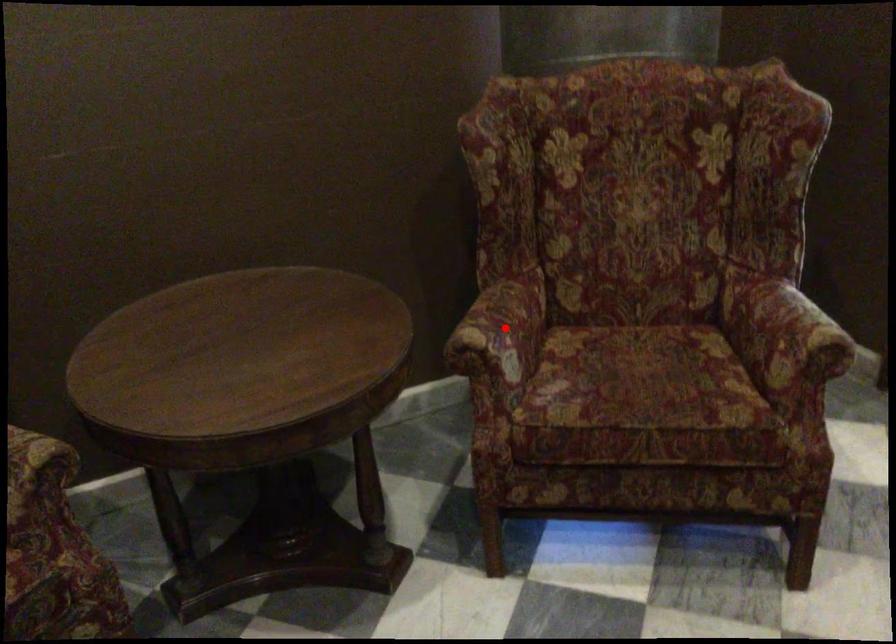
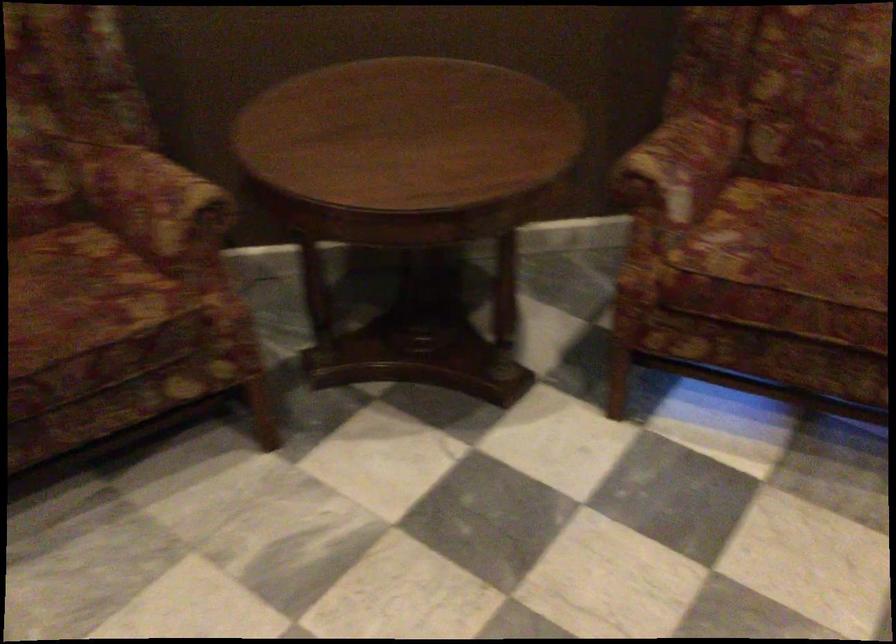
Locate, in the second image, the point that corresponds to the highlighted location in the first image.

(679, 164)